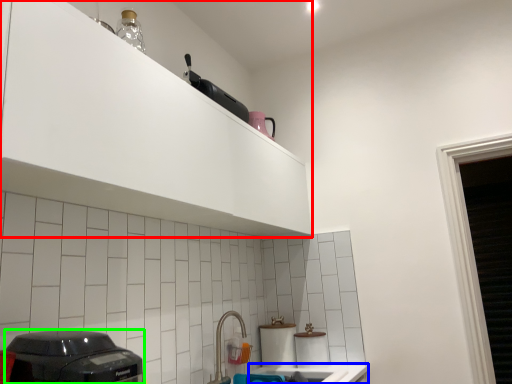
Question: Considering the real-world distances, which object is farthest from cabinetry (highlighted by a red box)? counter top (highlighted by a blue box) or home appliance (highlighted by a green box)?

Choices:
 (A) counter top
 (B) home appliance

Answer: (A)